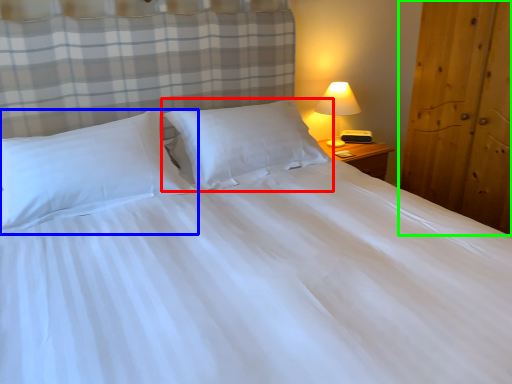
Question: Estimate the real-world distances between objects in this image. Which object is farther from pillow (highlighted by a red box), pillow (highlighted by a blue box) or armoire (highlighted by a green box)?

Choices:
 (A) pillow
 (B) armoire

Answer: (B)